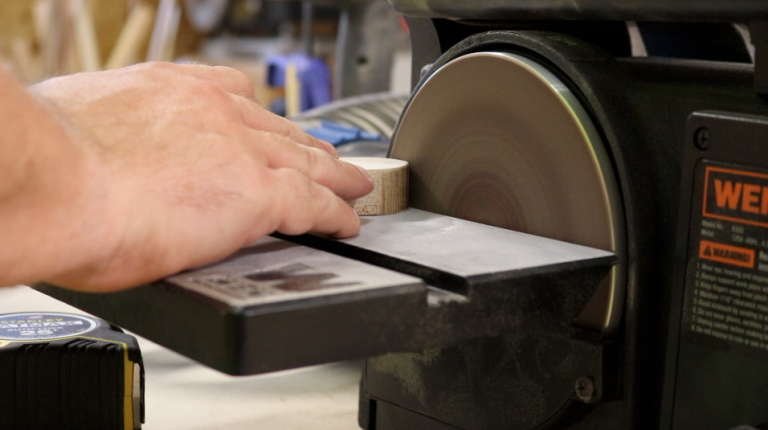
Find the location of a particular element. sticker is located at coordinates (37, 328).